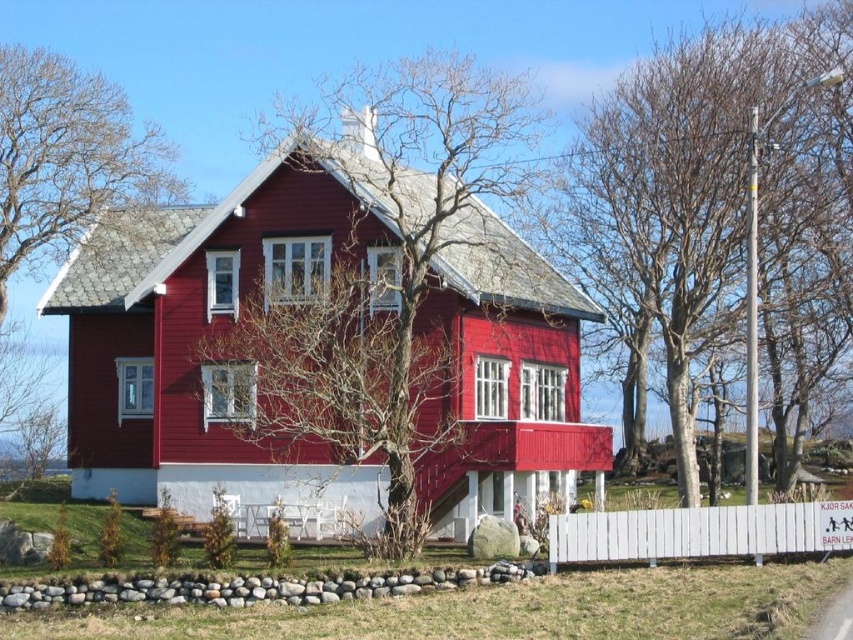
Question: Considering the real-world distances, which object is farthest from the white wooden fence at lower right?

Choices:
 (A) bare branches at upper center
 (B) bare wood tree at center

Answer: (A)

Question: Among these objects, which one is farthest from the camera?

Choices:
 (A) bare wood tree at center
 (B) white wooden fence at lower right

Answer: (A)

Question: Can you confirm if bare branches at upper center is positioned to the left of white wooden fence at lower right?

Choices:
 (A) no
 (B) yes

Answer: (A)

Question: Which object is positioned farthest from the white wooden fence at lower right?

Choices:
 (A) bare wood tree at center
 (B) bare branches at upper left

Answer: (B)

Question: Is bare branches at upper center wider than bare branches at upper left?

Choices:
 (A) yes
 (B) no

Answer: (B)

Question: Does bare wood tree at center appear on the right side of bare branches at upper left?

Choices:
 (A) no
 (B) yes

Answer: (B)